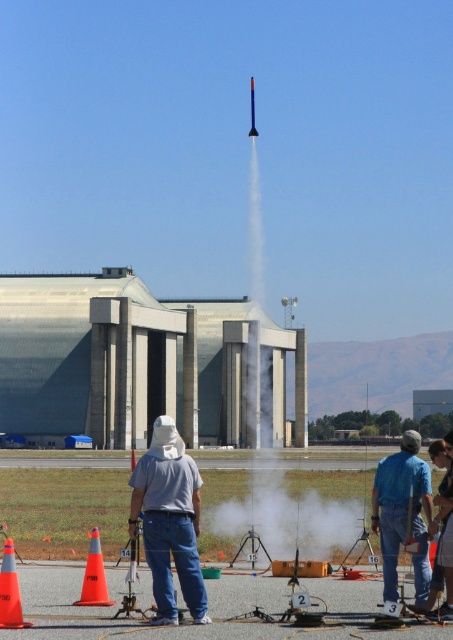
Question: Is orange plastic traffic cone at center thinner than blue glossy rocket at center?

Choices:
 (A) yes
 (B) no

Answer: (A)

Question: Estimate the real-world distances between objects in this image. Which object is closer to the blue glossy rocket at center?

Choices:
 (A) gray cotton shirt at center
 (B) blue denim jeans at center
 (C) concrete building at center

Answer: (C)

Question: Estimate the real-world distances between objects in this image. Which object is closer to the gray asphalt tarmac at center?

Choices:
 (A) orange plastic traffic cone at lower left
 (B) gray cotton shirt at center
 (C) concrete building at center

Answer: (B)

Question: Among these objects, which one is nearest to the camera?

Choices:
 (A) gray cotton shirt at center
 (B) gray asphalt tarmac at center

Answer: (B)

Question: Is concrete building at center to the right of gray asphalt tarmac at center from the viewer's perspective?

Choices:
 (A) no
 (B) yes

Answer: (A)

Question: Considering the relative positions of blue denim jeans at center and blue glossy rocket at center in the image provided, where is blue denim jeans at center located with respect to blue glossy rocket at center?

Choices:
 (A) right
 (B) left

Answer: (B)